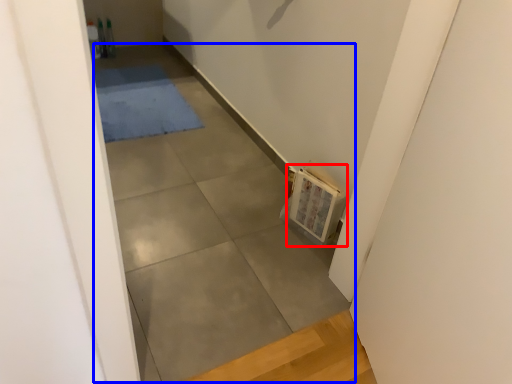
Question: Which object is further to the camera taking this photo, book (highlighted by a red box) or concrete (highlighted by a blue box)?

Choices:
 (A) book
 (B) concrete

Answer: (A)